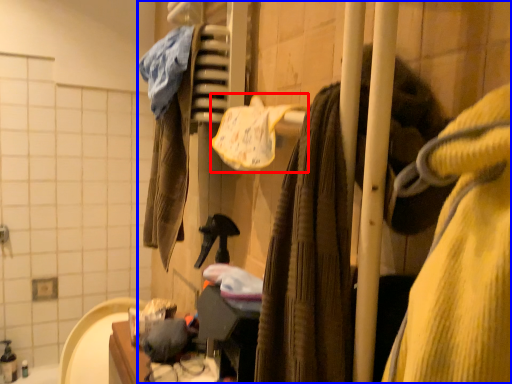
Question: Which point is closer to the camera, bath towel (highlighted by a red box) or closet (highlighted by a blue box)?

Choices:
 (A) bath towel
 (B) closet

Answer: (B)